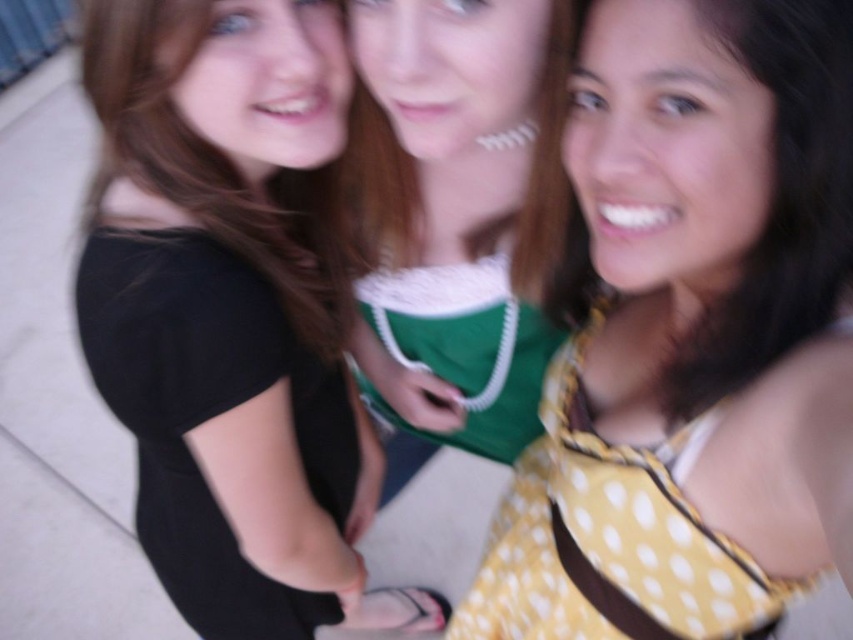
Question: Is yellow dotted dress at center smaller than yellow dotted dress at right?

Choices:
 (A) no
 (B) yes

Answer: (A)

Question: Observing the image, what is the correct spatial positioning of yellow dotted dress at center in reference to black matte shirt at upper left?

Choices:
 (A) above
 (B) below

Answer: (B)

Question: Does yellow dotted dress at center lie in front of black matte shirt at upper left?

Choices:
 (A) yes
 (B) no

Answer: (A)

Question: Which point is closer to the camera taking this photo?

Choices:
 (A) (190, 172)
 (B) (604, 154)

Answer: (B)

Question: Considering the real-world distances, which object is closest to the yellow dotted dress at center?

Choices:
 (A) black matte shirt at upper left
 (B) yellow dotted dress at right

Answer: (B)

Question: Which object appears closest to the camera in this image?

Choices:
 (A) black matte dress at left
 (B) yellow dotted dress at right
 (C) yellow dotted dress at center

Answer: (C)